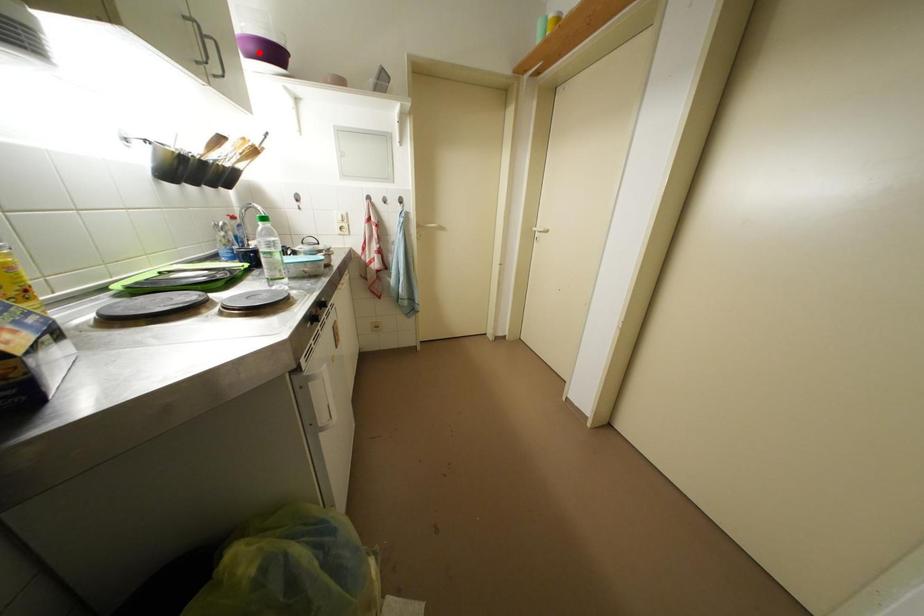
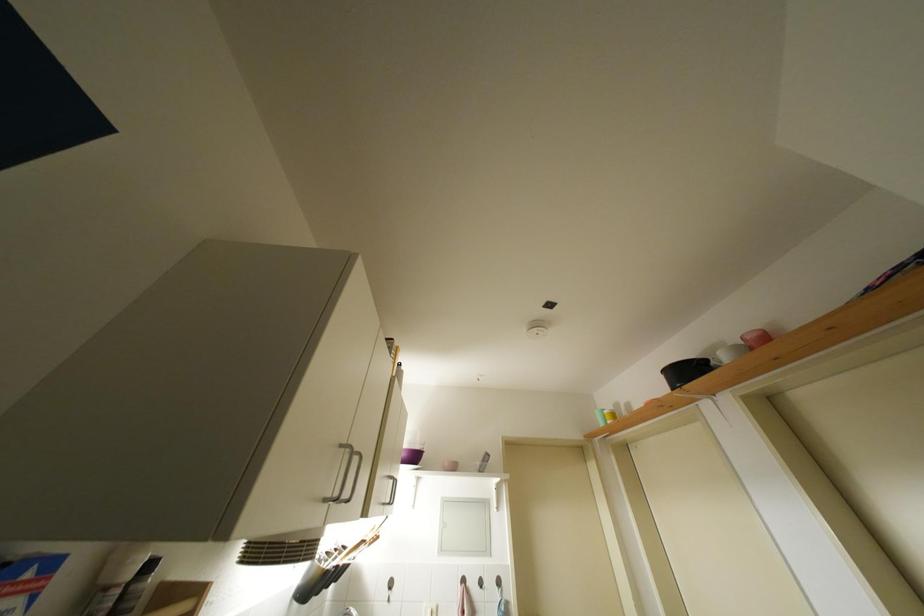
In the second image, find the point that corresponds to the highlighted location in the first image.

(410, 459)